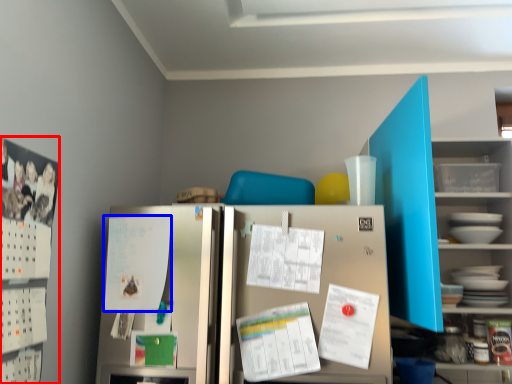
Question: Which object appears closest to the camera in this image, bulletin board (highlighted by a red box) or paper (highlighted by a blue box)?

Choices:
 (A) bulletin board
 (B) paper

Answer: (A)